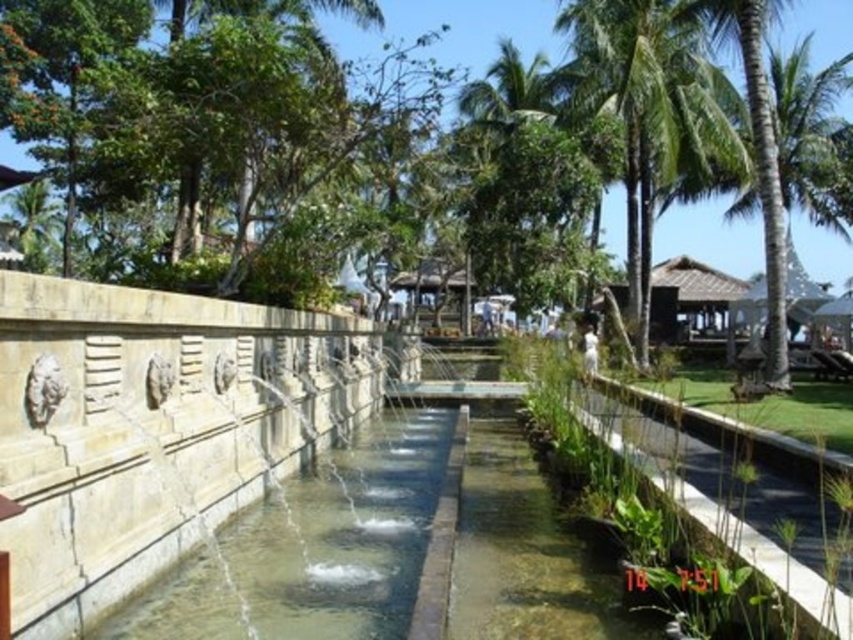
Question: Which object is closer to the camera taking this photo?

Choices:
 (A) green leafy tree at upper center
 (B) green leafy palm tree at upper right
 (C) clear concrete pathway at center
 (D) green leafy palm tree at center

Answer: (C)

Question: Can you confirm if green leafy tree at upper center is wider than green leafy palm tree at center?

Choices:
 (A) no
 (B) yes

Answer: (B)

Question: Estimate the real-world distances between objects in this image. Which object is closer to the green leafy palm tree at upper right?

Choices:
 (A) clear concrete pathway at center
 (B) green leafy tree at upper center

Answer: (B)

Question: Does clear concrete pathway at center come behind green leafy palm tree at center?

Choices:
 (A) yes
 (B) no

Answer: (B)

Question: Does green leafy palm tree at upper right have a lesser width compared to green leafy palm tree at center?

Choices:
 (A) yes
 (B) no

Answer: (B)

Question: Which point is farther to the camera?

Choices:
 (A) (506, 131)
 (B) (381, 35)

Answer: (A)